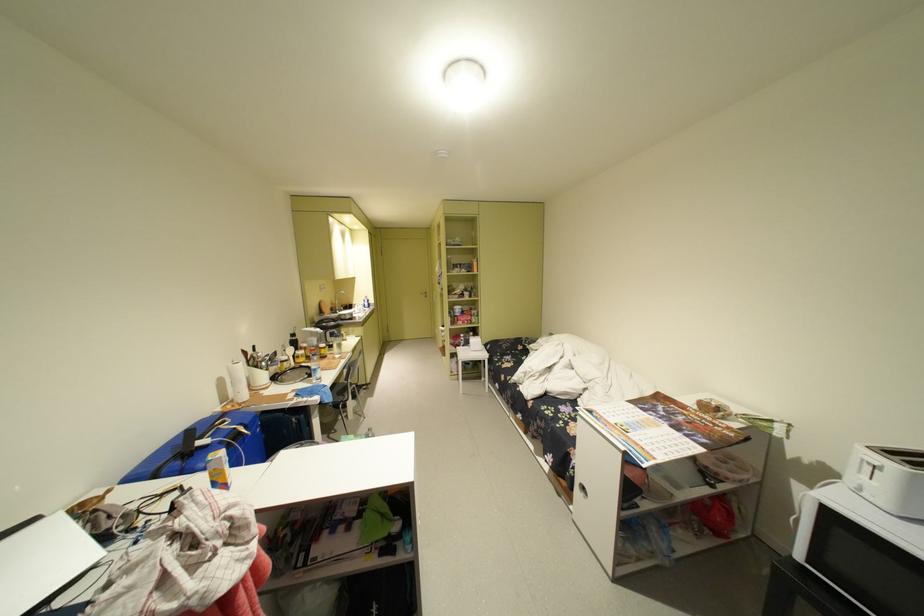
Image resolution: width=924 pixels, height=616 pixels. Find the location of `cabinet hole handle`. cabinet hole handle is located at coordinates (581, 490).